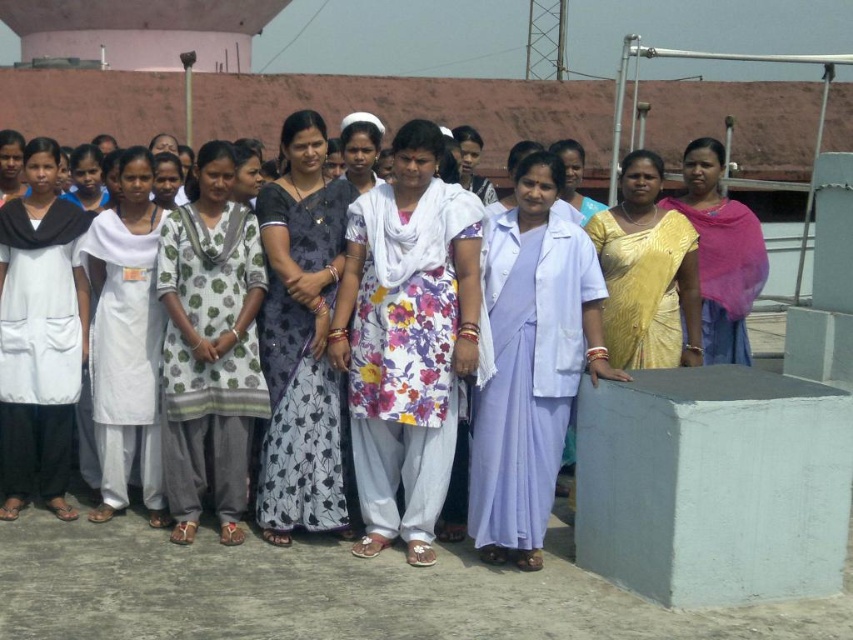
You are standing at a distance of 100 feet away from the point marked at coordinates point (228, 164). If you move forward 10 feet, will you be closer to the point than 89.16 feet?

The distance of point (228, 164) from viewer is 89.16 feet. Moving forward 10 feet reduces your distance to 90 feet, which is still farther than 89.16 feet. Therefore, you will not be closer than 89.16 feet.

You are standing on the rooftop and want to move from the point at coordinates point (119, 300) to the point at coordinates point (675, 278). Which direction should you move to get closer to the latter point?

Since point (119, 300) is closer to the viewer than point (675, 278), you should move backward to reach the latter point.